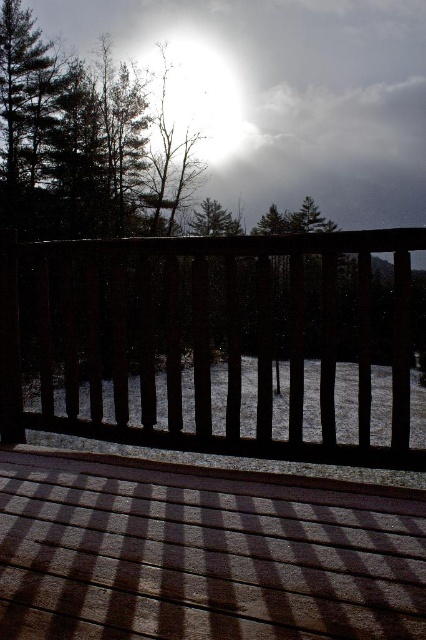
Is point (77, 301) in front of point (32, 163)?

Yes, point (77, 301) is closer to viewer.

Which is below, brown wooden balustrade at center or dark green textured tree at upper left?

brown wooden balustrade at center is below.

Does point (230, 445) come in front of point (5, 148)?

Yes.

At what (x,y) coordinates should I click in order to perform the action: click on brown wooden balustrade at center. Please return your answer as a coordinate pair (x, y). The image size is (426, 640). Looking at the image, I should click on (196, 337).

Based on the photo, is brown wooden deck at center bigger than brown wooden balustrade at center?

Actually, brown wooden deck at center might be smaller than brown wooden balustrade at center.

Who is more distant from viewer, (371,595) or (233,307)?

Positioned behind is point (233,307).

At what (x,y) coordinates should I click in order to perform the action: click on brown wooden deck at center. Please return your answer as a coordinate pair (x, y). Looking at the image, I should click on (203, 552).

Looking at this image, is dark green textured tree at upper left above bright white light at upper center?

Incorrect, dark green textured tree at upper left is not positioned above bright white light at upper center.

Which of these two, dark green textured tree at upper left or bright white light at upper center, stands shorter?

bright white light at upper center is shorter.

What do you see at coordinates (74, 141) in the screenshot? I see `dark green textured tree at upper left` at bounding box center [74, 141].

Where is `dark green textured tree at upper left`? This screenshot has width=426, height=640. dark green textured tree at upper left is located at coordinates (74, 141).